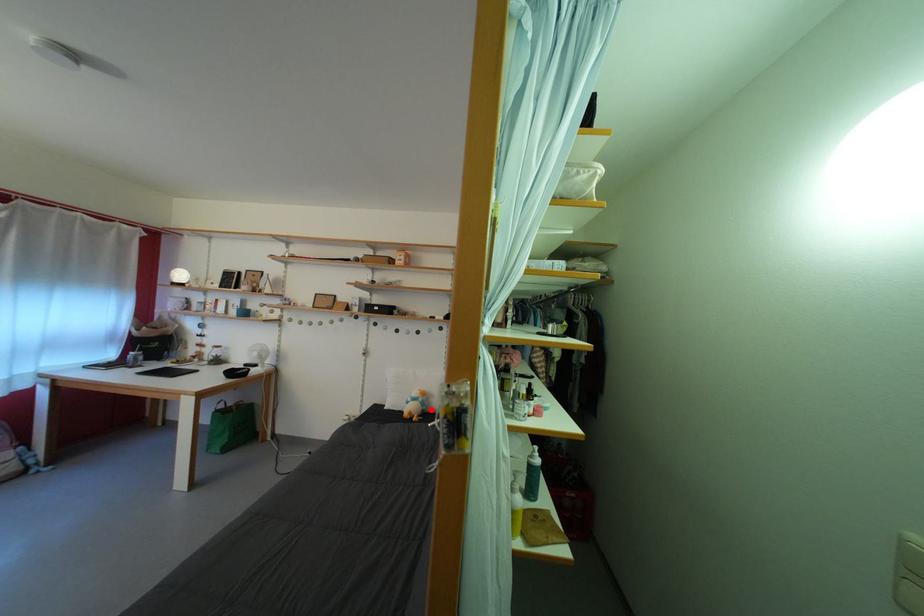
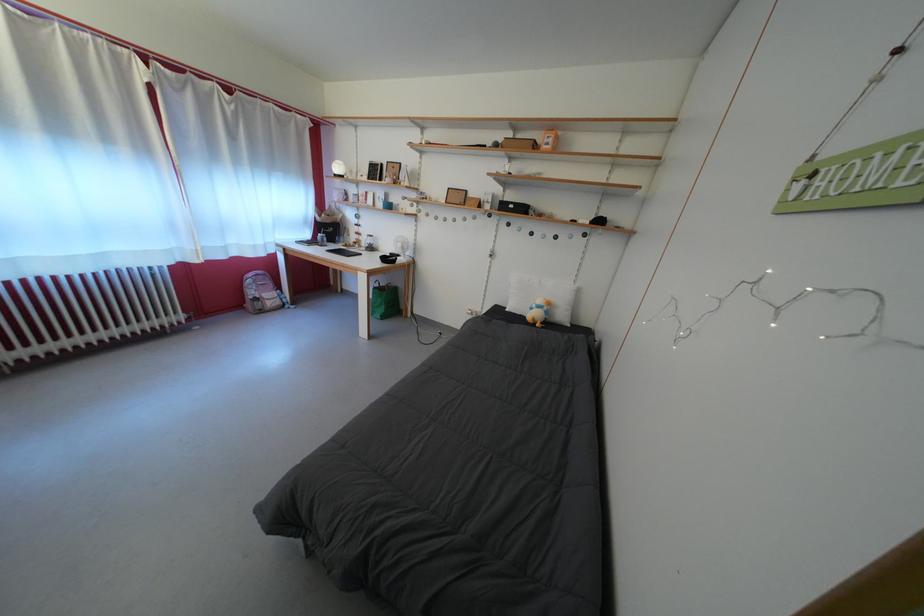
Locate, in the second image, the point that corresponds to the highlighted location in the first image.

(554, 318)